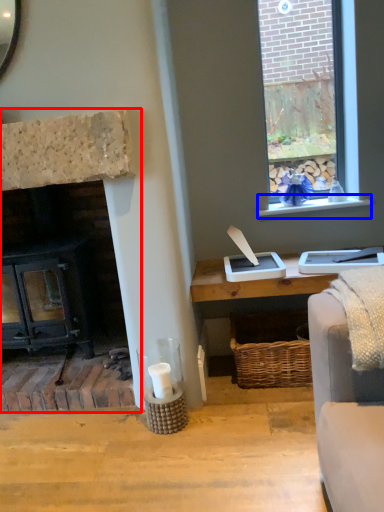
Question: Which object is further to the camera taking this photo, fireplace (highlighted by a red box) or window sill (highlighted by a blue box)?

Choices:
 (A) fireplace
 (B) window sill

Answer: (B)